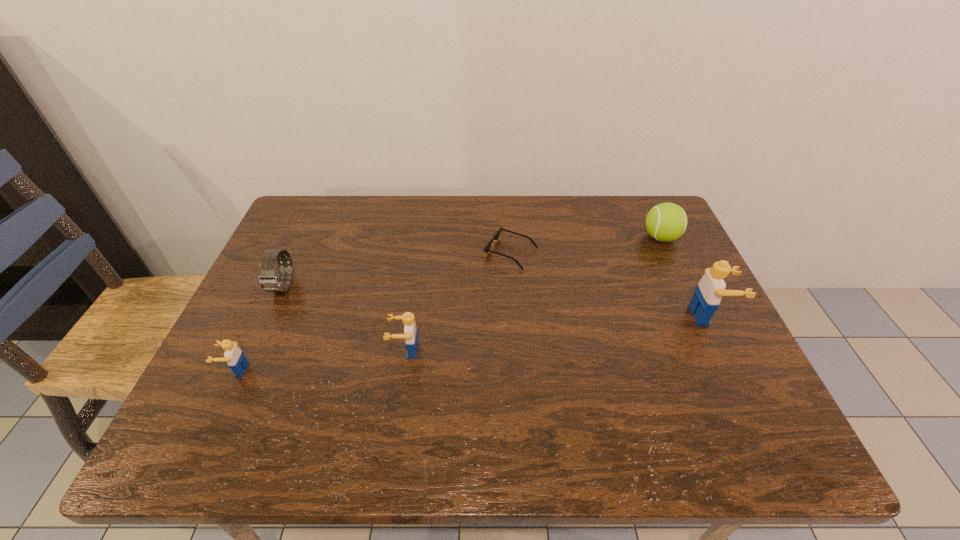
Please mark a free spot for a new Lego to balance the arrangement. Please provide its 2D coordinates. Your answer should be formatted as a tuple, i.e. [(x, y)], where the tuple contains the x and y coordinates of a point satisfying the conditions above.

[(563, 332)]